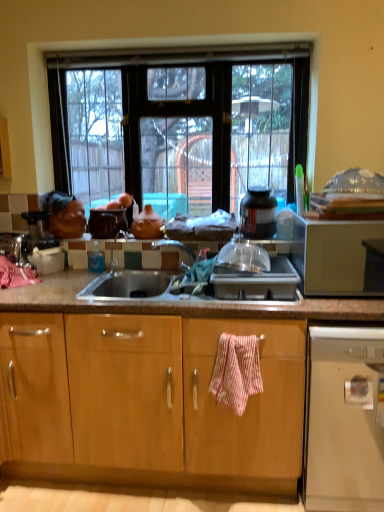
Question: Is satin gold microwave at right touching satin silver gas stove at center?

Choices:
 (A) no
 (B) yes

Answer: (A)

Question: Is satin gold microwave at right bigger than satin silver gas stove at center?

Choices:
 (A) yes
 (B) no

Answer: (A)

Question: From the image's perspective, is satin gold microwave at right on satin silver gas stove at center?

Choices:
 (A) yes
 (B) no

Answer: (A)

Question: Can we say satin gold microwave at right lies outside satin silver gas stove at center?

Choices:
 (A) yes
 (B) no

Answer: (A)

Question: Is satin gold microwave at right to the left of satin silver gas stove at center from the viewer's perspective?

Choices:
 (A) no
 (B) yes

Answer: (A)

Question: Looking at their shapes, would you say pink striped towel at center is wider or thinner than matte clay pot at center?

Choices:
 (A) wide
 (B) thin

Answer: (B)

Question: Considering the relative positions of pink striped towel at center and matte clay pot at center in the image provided, is pink striped towel at center to the left or to the right of matte clay pot at center?

Choices:
 (A) right
 (B) left

Answer: (A)

Question: From a real-world perspective, is pink striped towel at center above or below matte clay pot at center?

Choices:
 (A) below
 (B) above

Answer: (A)

Question: Is pink striped towel at center situated inside matte clay pot at center or outside?

Choices:
 (A) outside
 (B) inside

Answer: (A)

Question: Is point coord(195,83) positioned closer to the camera than point coord(294,294)?

Choices:
 (A) farther
 (B) closer

Answer: (A)

Question: Is transparent glass window at center spatially inside satin silver gas stove at center, or outside of it?

Choices:
 (A) inside
 (B) outside

Answer: (B)

Question: Is transparent glass window at center wider or thinner than satin silver gas stove at center?

Choices:
 (A) wide
 (B) thin

Answer: (B)

Question: Is transparent glass window at center in front of or behind satin silver gas stove at center in the image?

Choices:
 (A) front
 (B) behind

Answer: (B)

Question: From the image's perspective, is white plastic dishwasher at lower right above or below pink striped towel at center?

Choices:
 (A) below
 (B) above

Answer: (A)

Question: Does point (336, 394) appear closer or farther from the camera than point (253, 351)?

Choices:
 (A) closer
 (B) farther

Answer: (A)